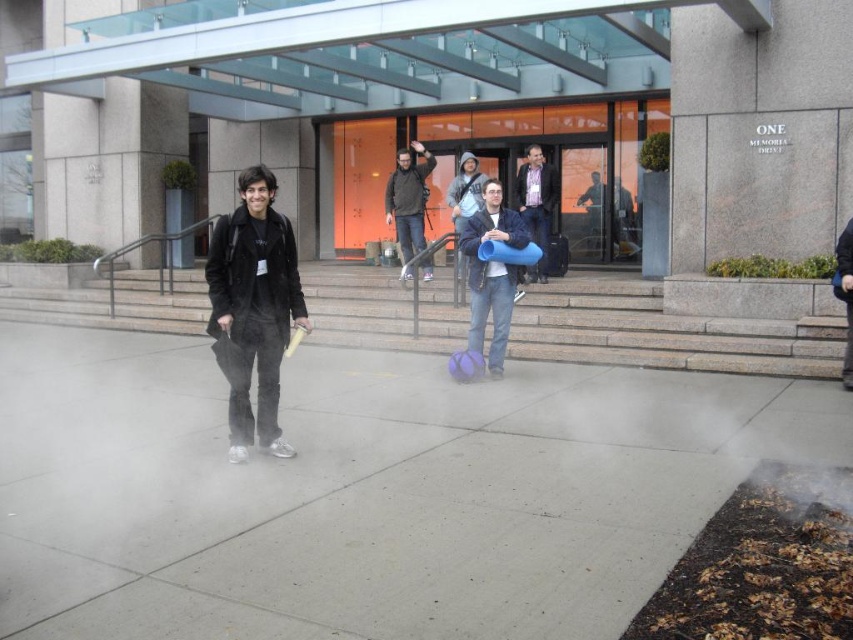
Which is above, gray concrete stairs at center or black fuzzy coat at center?

Positioned higher is gray concrete stairs at center.

This screenshot has height=640, width=853. What do you see at coordinates (668, 332) in the screenshot? I see `gray concrete stairs at center` at bounding box center [668, 332].

Who is more distant from viewer, (576, 298) or (259, 209)?

Positioned behind is point (576, 298).

Where is `gray concrete stairs at center`? The width and height of the screenshot is (853, 640). gray concrete stairs at center is located at coordinates (668, 332).

How distant is blue rubber mat at center from blue rubber tube at center?

The distance of blue rubber mat at center from blue rubber tube at center is 3.04 meters.

Is the position of blue rubber mat at center more distant than that of blue rubber tube at center?

No, blue rubber mat at center is closer to the viewer.

Does point (512, 284) lie in front of point (543, 214)?

That is True.

This screenshot has width=853, height=640. Identify the location of blue rubber mat at center. (491, 273).

Measure the distance between point (45, 531) and camera.

Point (45, 531) and camera are 3.85 meters apart.

Identify the location of gray concrete pavement at center. (364, 490).